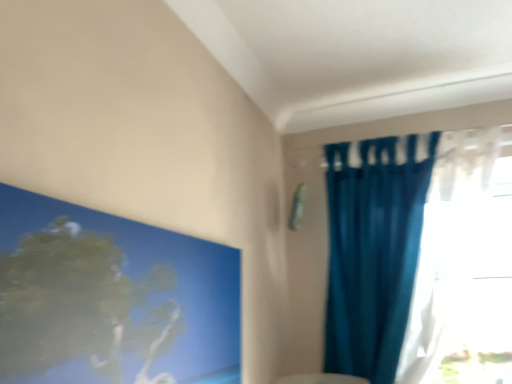
Question: Considering the positions of point (470, 182) and point (50, 256), is point (470, 182) closer or farther from the camera than point (50, 256)?

Choices:
 (A) closer
 (B) farther

Answer: (B)

Question: Considering the positions of teal fabric curtain at right and smooth blue painting at upper left in the image, is teal fabric curtain at right wider or thinner than smooth blue painting at upper left?

Choices:
 (A) wide
 (B) thin

Answer: (A)

Question: In terms of size, does teal fabric curtain at right appear bigger or smaller than smooth blue painting at upper left?

Choices:
 (A) big
 (B) small

Answer: (A)

Question: Considering the positions of point (136, 281) and point (370, 339), is point (136, 281) closer or farther from the camera than point (370, 339)?

Choices:
 (A) farther
 (B) closer

Answer: (B)

Question: Considering the positions of smooth blue painting at upper left and teal fabric curtain at right in the image, is smooth blue painting at upper left wider or thinner than teal fabric curtain at right?

Choices:
 (A) wide
 (B) thin

Answer: (B)

Question: Considering the positions of smooth blue painting at upper left and teal fabric curtain at right in the image, is smooth blue painting at upper left taller or shorter than teal fabric curtain at right?

Choices:
 (A) tall
 (B) short

Answer: (B)

Question: Is smooth blue painting at upper left spatially inside teal fabric curtain at right, or outside of it?

Choices:
 (A) inside
 (B) outside

Answer: (B)